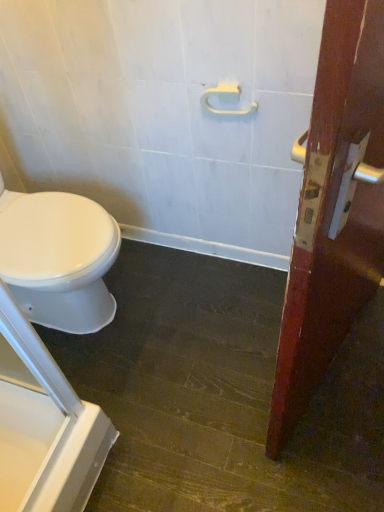
Locate an element on the screen. This screenshot has height=512, width=384. vacant location below wooden door at right (from a real-world perspective) is located at coordinates (332, 372).